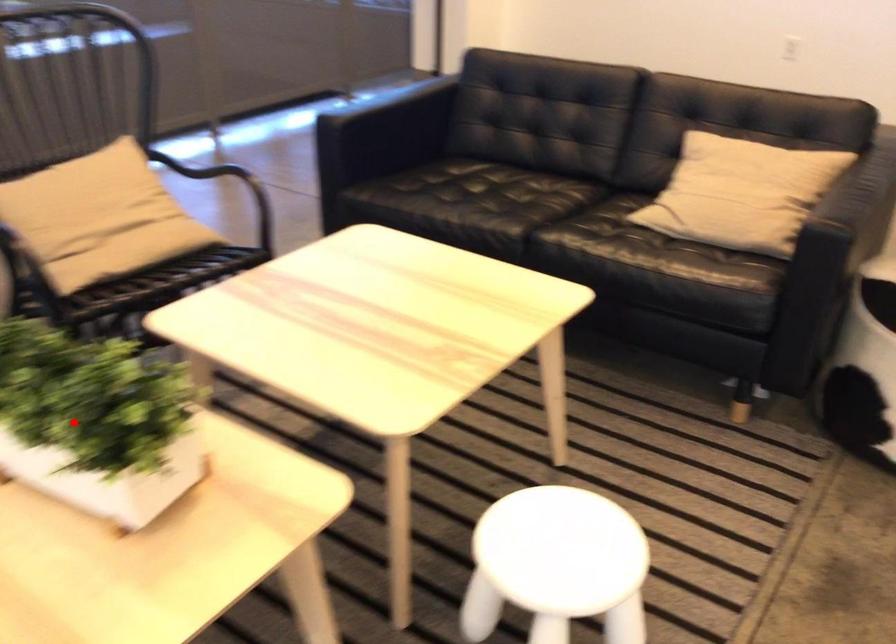
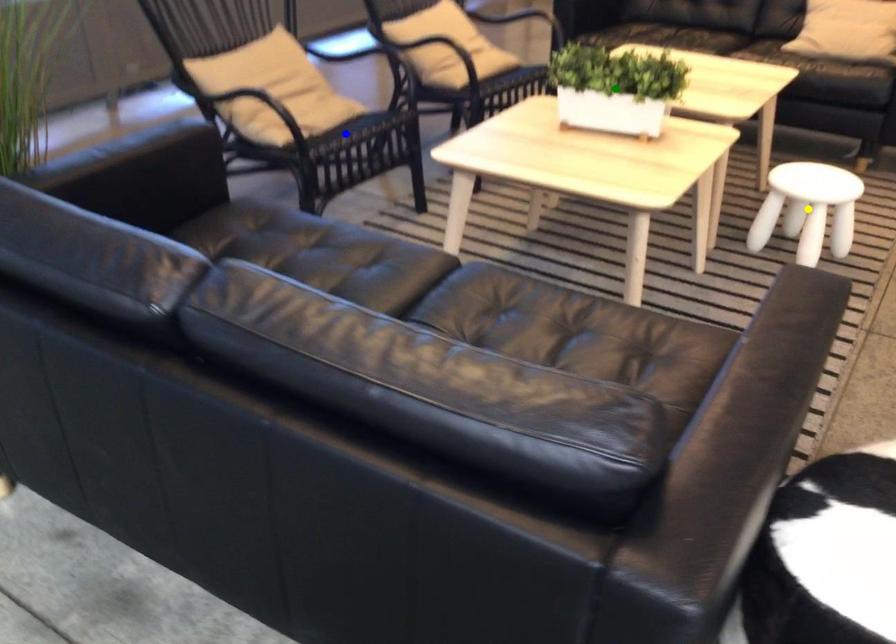
Question: I am providing you with two images of the same scene from different viewpoints. A red point is marked on the first image. You are given multiple points on the second image. In image 2, which mark is for the same physical point as the one in image 1?

Choices:
 (A) yellow point
 (B) blue point
 (C) green point

Answer: (C)